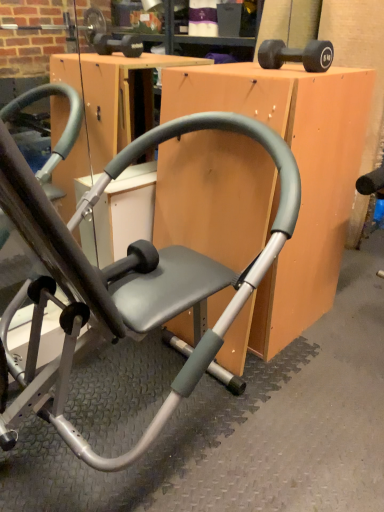
Question: Considering the relative sizes of matte gray chair at center and matte gray chair at center in the image provided, is matte gray chair at center thinner than matte gray chair at center?

Choices:
 (A) yes
 (B) no

Answer: (A)

Question: Is matte gray chair at center positioned far away from matte gray chair at center?

Choices:
 (A) yes
 (B) no

Answer: (B)

Question: Is the depth of matte gray chair at center greater than that of matte gray chair at center?

Choices:
 (A) yes
 (B) no

Answer: (A)

Question: Is matte gray chair at center smaller than matte gray chair at center?

Choices:
 (A) no
 (B) yes

Answer: (B)

Question: From the image's perspective, is matte gray chair at center located above matte gray chair at center?

Choices:
 (A) yes
 (B) no

Answer: (A)

Question: From the image's perspective, is matte gray chair at center above or below matte gray chair at center?

Choices:
 (A) below
 (B) above

Answer: (A)

Question: Considering the positions of point (198, 257) and point (240, 95), is point (198, 257) closer or farther from the camera than point (240, 95)?

Choices:
 (A) closer
 (B) farther

Answer: (B)

Question: In terms of height, does matte gray chair at center look taller or shorter compared to matte gray chair at center?

Choices:
 (A) tall
 (B) short

Answer: (A)

Question: From a real-world perspective, is matte gray chair at center physically located above or below matte gray chair at center?

Choices:
 (A) below
 (B) above

Answer: (B)

Question: Considering the positions of point (167, 231) and point (273, 44), is point (167, 231) closer or farther from the camera than point (273, 44)?

Choices:
 (A) closer
 (B) farther

Answer: (B)

Question: From the image's perspective, relative to black rubber dumbbell at upper right, is matte gray chair at center above or below?

Choices:
 (A) below
 (B) above

Answer: (A)

Question: Looking at the image, does matte gray chair at center seem bigger or smaller compared to black rubber dumbbell at upper right?

Choices:
 (A) small
 (B) big

Answer: (B)

Question: From a real-world perspective, is matte gray chair at center above or below black rubber dumbbell at upper right?

Choices:
 (A) below
 (B) above

Answer: (A)

Question: From their relative heights in the image, would you say matte gray chair at center is taller or shorter than black rubber dumbbell at upper right?

Choices:
 (A) tall
 (B) short

Answer: (A)

Question: Relative to black rubber dumbbell at upper right, is matte gray chair at center in front or behind?

Choices:
 (A) front
 (B) behind

Answer: (A)